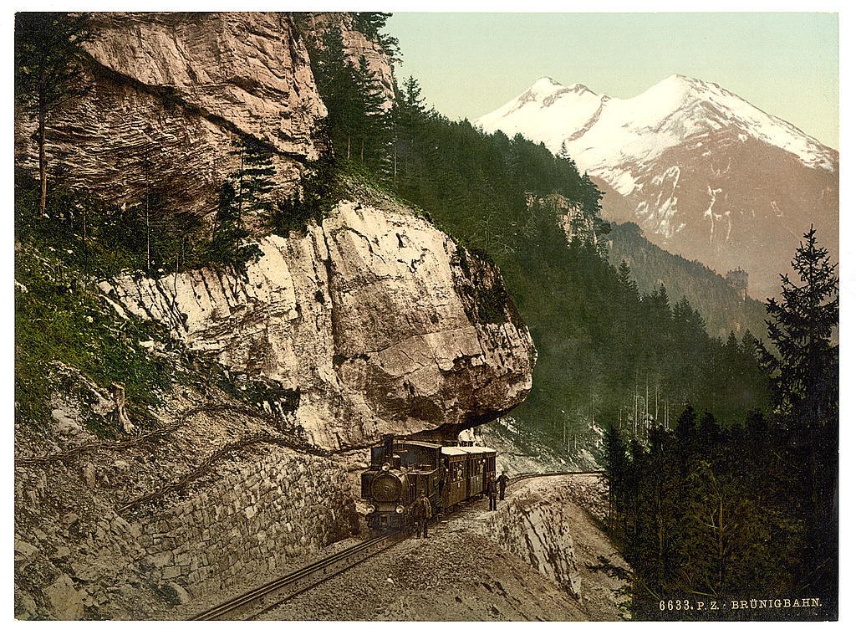
Which is more to the left, white snow-covered mountain at upper center or smooth metal train track at center?

smooth metal train track at center

Can you confirm if white snow-covered mountain at upper center is positioned below smooth metal train track at center?

No.

Is point (565, 84) farther from camera compared to point (375, 536)?

Yes, point (565, 84) is behind point (375, 536).

Locate an element on the screen. The width and height of the screenshot is (856, 640). white snow-covered mountain at upper center is located at coordinates (690, 170).

Who is higher up, white snow-covered mountain at upper center or black metal train at center?

white snow-covered mountain at upper center

Does white snow-covered mountain at upper center appear over black metal train at center?

Yes.

Find the location of a particular element. Image resolution: width=856 pixels, height=640 pixels. white snow-covered mountain at upper center is located at coordinates (690, 170).

Which is behind, point (421, 458) or point (317, 573)?

Point (421, 458)

Is the position of black metal train at center less distant than that of smooth metal train track at center?

No.

What do you see at coordinates (421, 477) in the screenshot? The height and width of the screenshot is (640, 856). I see `black metal train at center` at bounding box center [421, 477].

Locate an element on the screen. black metal train at center is located at coordinates (421, 477).